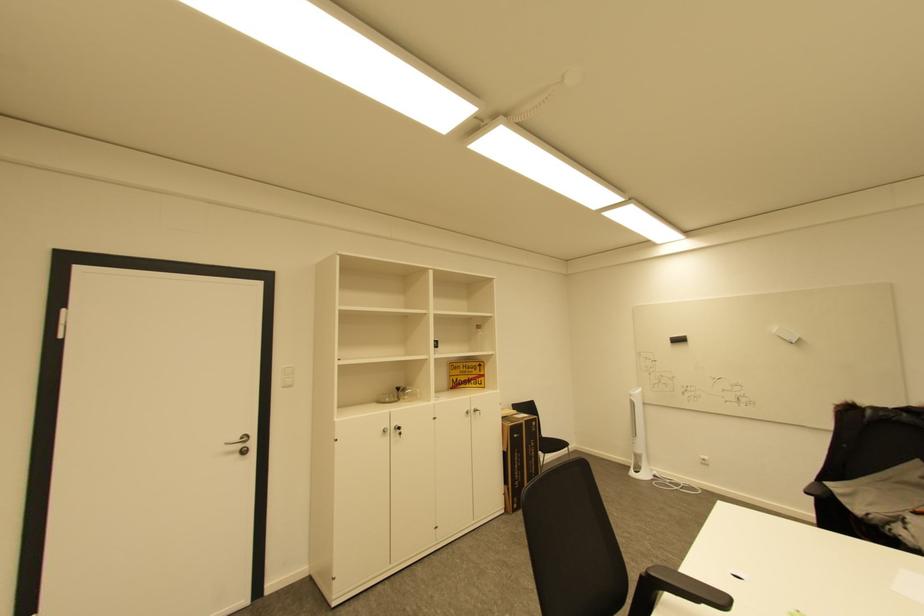
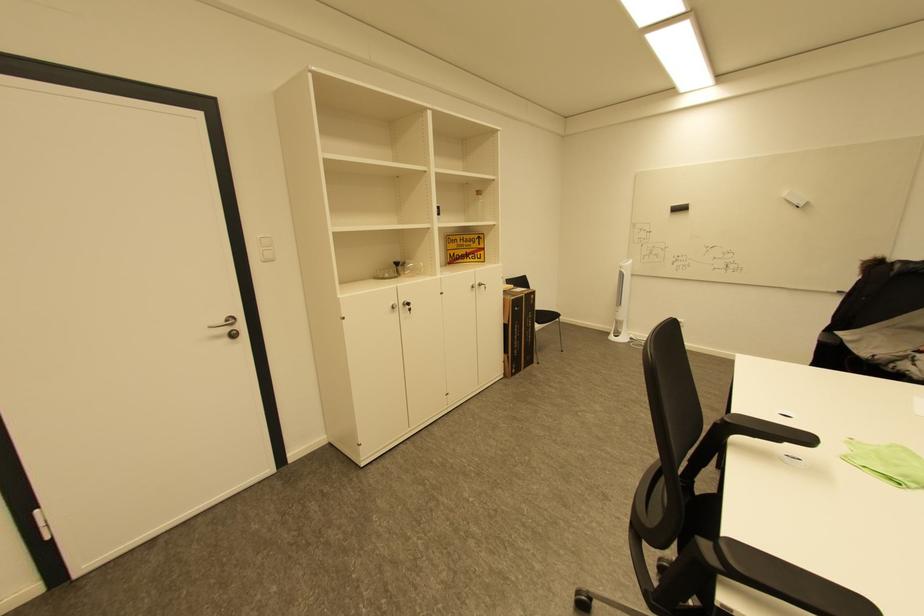
Question: Based on the continuous images, in which direction is the camera rotating? Reply with the corresponding letter.

Choices:
 (A) Left
 (B) Right
 (C) Up
 (D) Down

Answer: (D)